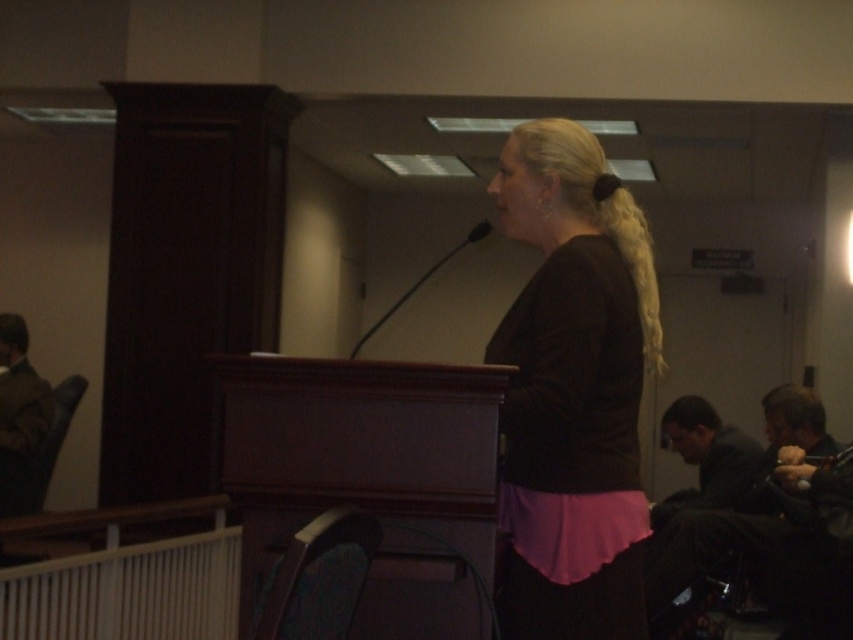
You are an interior designer assessing the courtroom setup. You notice the matte brown blouse at center and the black matte microphone at center. Which object occupies a larger physical space in the scene?

The black matte microphone at center is larger than the matte brown blouse at center, so it occupies a larger physical space in the scene.

You are an interior designer assessing the courtroom layout. You need to ensure that the matte brown blouse at center and the black matte microphone at center are visible to the audience. Based on their heights, which object might require adjustment to ensure proper visibility?

The black matte microphone at center is shorter than the matte brown blouse at center, so it might need to be raised to ensure its visibility to the audience.

You are a photographer in a courtroom setting. You need to capture a clear photo of the speaker wearing the matte brown blouse at center without including the black matte microphone at center in the frame. Based on their positions, is this possible?

The matte brown blouse at center is 26.78 inches away from the black matte microphone at center. Since the distance between them is significant, it is possible to frame the photo to include the matte brown blouse at center while excluding the black matte microphone at center.